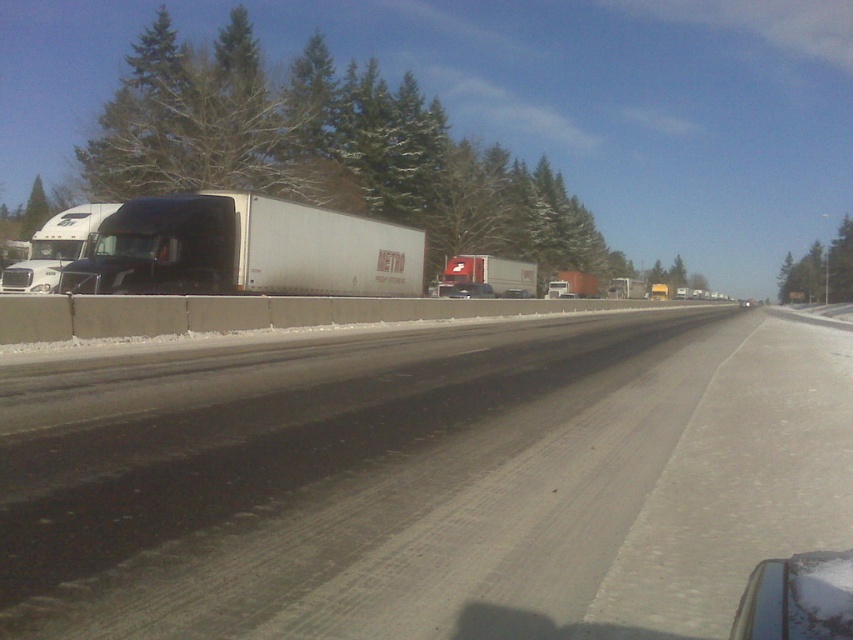
Consider the image. You are standing at the point marked as point (421, 480) in the image. What is the material of the surface you are currently standing on?

The gray asphalt highway at center is located at point (421, 480), so you are standing on asphalt.

Based on the photo, you are a delivery driver who needs to pass the white matte trailer truck at left. There is a white matte truck at center in the same lane. Considering the width of both vehicles, which truck would be easier to overtake?

The white matte truck at center has a smaller width than the white matte trailer truck at left, making it easier to overtake since it requires less space to maneuver around.

Looking at this image, you are a driver planning to overtake the white glossy truck at left on the gray asphalt highway at center. Can you safely perform this maneuver if the highway is wide enough for two vehicles side by side?

The gray asphalt highway at center is wider than the white glossy truck at left, so yes, you can safely overtake the white glossy truck at left on the gray asphalt highway at center since the highway is wide enough for two vehicles side by side.